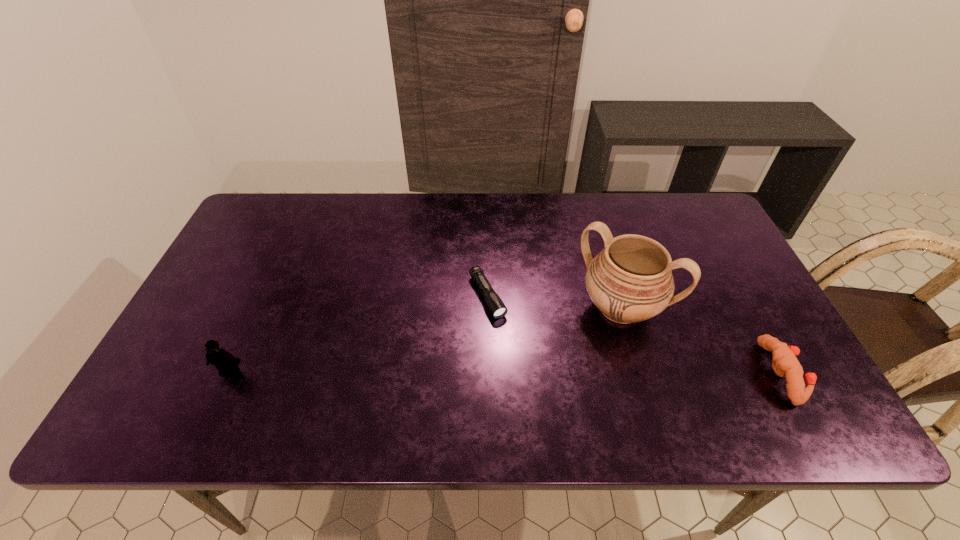
You are a GUI agent. You are given a task and a screenshot of the screen. Output one action in this format:
    pyautogui.click(x=<x>, y=<y>)
    Task: Click on the vacant space on the desktop that is between the third shortest object and the rightmost object and is positioned on the front-facing side of the urn
    
    Given the screenshot: What is the action you would take?
    pyautogui.click(x=576, y=373)

The image size is (960, 540). I want to click on free space on the desktop that is between the leftmost object and the third tallest object and is positioned at the lens end of the shortest object, so click(532, 372).